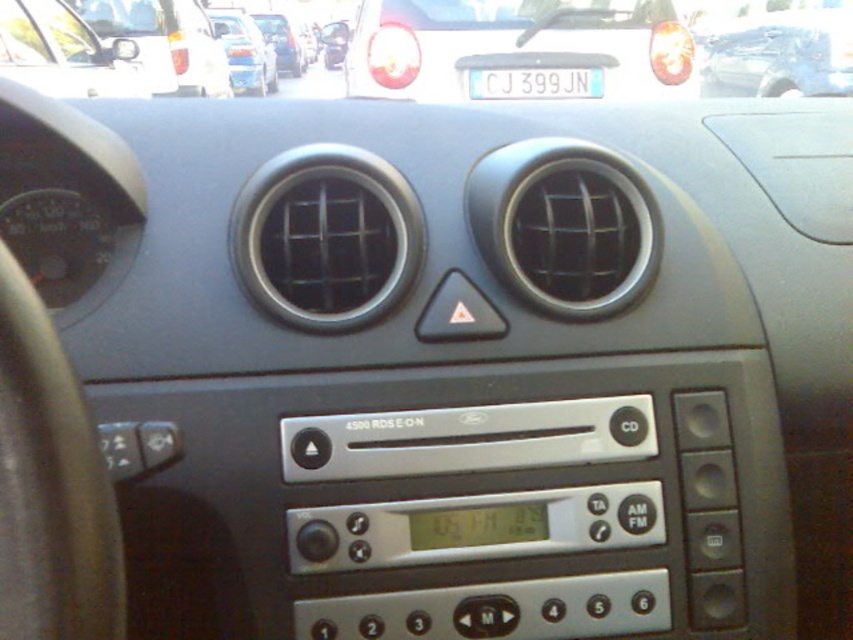
Does point (152, 3) lie behind point (602, 88)?

Yes.

Looking at this image, who is more forward, (148, 49) or (570, 86)?

Point (570, 86)

In order to click on white glossy car at upper left in this screenshot , I will do `click(165, 42)`.

Who is more distant from viewer, (x=808, y=65) or (x=50, y=93)?

Positioned behind is point (x=808, y=65).

Between metallic silver car at upper right and metallic silver side mirror at upper left, which one has more height?

Standing taller between the two is metallic silver car at upper right.

What do you see at coordinates (778, 52) in the screenshot? This screenshot has width=853, height=640. I see `metallic silver car at upper right` at bounding box center [778, 52].

Identify the location of metallic silver car at upper right. The height and width of the screenshot is (640, 853). (778, 52).

Measure the distance between metallic silver side mirror at upper left and white plastic license plate at center.

metallic silver side mirror at upper left and white plastic license plate at center are 8.66 feet apart from each other.

Can you confirm if metallic silver side mirror at upper left is taller than white plastic license plate at center?

Yes.

Which is behind, point (45, 38) or point (531, 88)?

Positioned behind is point (45, 38).

The height and width of the screenshot is (640, 853). Identify the location of metallic silver side mirror at upper left. (62, 52).